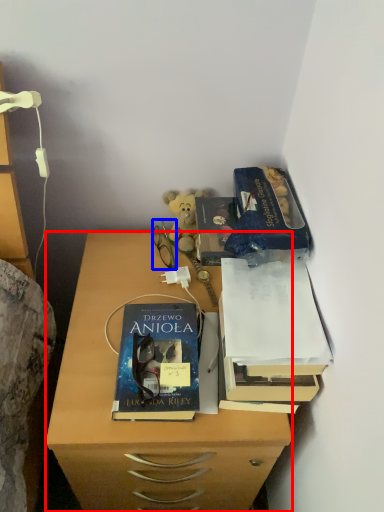
Question: Among these objects, which one is nearest to the camera, desk (highlighted by a red box) or glasses (highlighted by a blue box)?

Choices:
 (A) desk
 (B) glasses

Answer: (A)